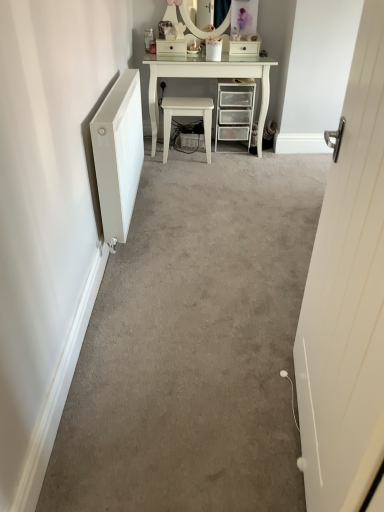
The height and width of the screenshot is (512, 384). Identify the location of vacant area situated to the left side of white wooden door at right. (196, 429).